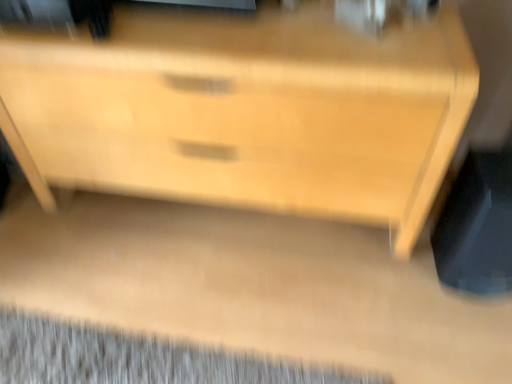
Question: Is black plastic swivel chair at lower right outside gray textured mat at lower left?

Choices:
 (A) no
 (B) yes

Answer: (B)

Question: Is there a large distance between black plastic swivel chair at lower right and gray textured mat at lower left?

Choices:
 (A) no
 (B) yes

Answer: (A)

Question: Can you confirm if black plastic swivel chair at lower right is thinner than gray textured mat at lower left?

Choices:
 (A) yes
 (B) no

Answer: (A)

Question: Considering the relative sizes of black plastic swivel chair at lower right and gray textured mat at lower left in the image provided, is black plastic swivel chair at lower right smaller than gray textured mat at lower left?

Choices:
 (A) yes
 (B) no

Answer: (B)

Question: Is black plastic swivel chair at lower right wider than gray textured mat at lower left?

Choices:
 (A) yes
 (B) no

Answer: (B)

Question: From the image's perspective, is black plastic swivel chair at lower right over gray textured mat at lower left?

Choices:
 (A) no
 (B) yes

Answer: (B)

Question: Is light wood chest of drawers at center facing away from black plastic swivel chair at lower right?

Choices:
 (A) no
 (B) yes

Answer: (A)

Question: From a real-world perspective, is light wood chest of drawers at center beneath black plastic swivel chair at lower right?

Choices:
 (A) no
 (B) yes

Answer: (A)

Question: From the image's perspective, is light wood chest of drawers at center beneath black plastic swivel chair at lower right?

Choices:
 (A) yes
 (B) no

Answer: (B)

Question: Is light wood chest of drawers at center positioned in front of black plastic swivel chair at lower right?

Choices:
 (A) yes
 (B) no

Answer: (A)

Question: Is light wood chest of drawers at center wider than black plastic swivel chair at lower right?

Choices:
 (A) yes
 (B) no

Answer: (A)

Question: Is light wood chest of drawers at center taller than black plastic swivel chair at lower right?

Choices:
 (A) yes
 (B) no

Answer: (A)

Question: From a real-world perspective, is gray textured mat at lower left over black plastic swivel chair at lower right?

Choices:
 (A) no
 (B) yes

Answer: (A)